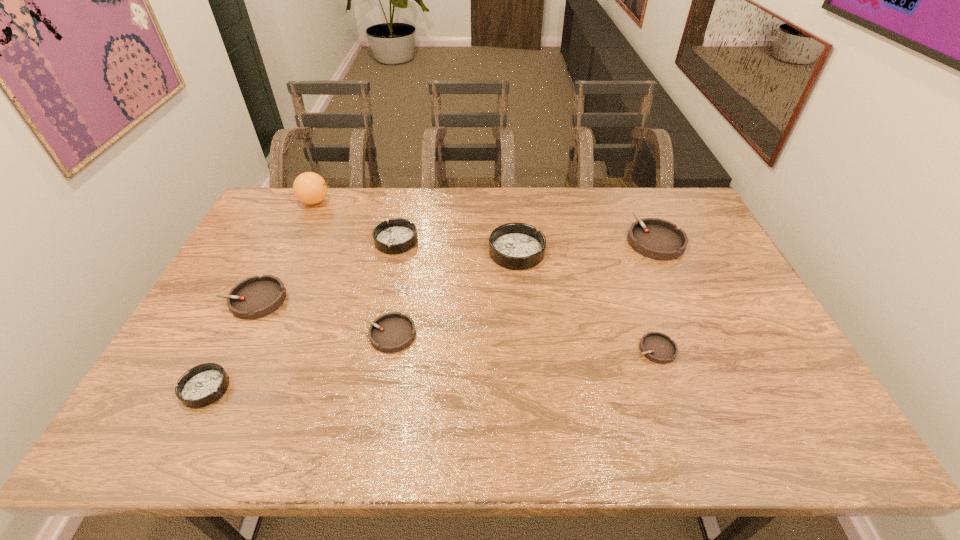
At what (x,y) coordinates should I click in order to perform the action: click on blank space that satisfies the following two spatial constraints: 1. on the back side of the biggest gray ashtray; 2. on the side with brand of the ping-pong ball. Please return your answer as a coordinate pair (x, y). This screenshot has height=540, width=960. Looking at the image, I should click on (637, 202).

I want to click on free space that satisfies the following two spatial constraints: 1. on the front side of the second smallest gray ashtray; 2. on the right side of the shortest ashtray, so (x=387, y=349).

This screenshot has height=540, width=960. Identify the location of free location that satisfies the following two spatial constraints: 1. on the back side of the biggest gray ashtray; 2. on the left side of the third smallest gray ashtray. pyautogui.click(x=284, y=240).